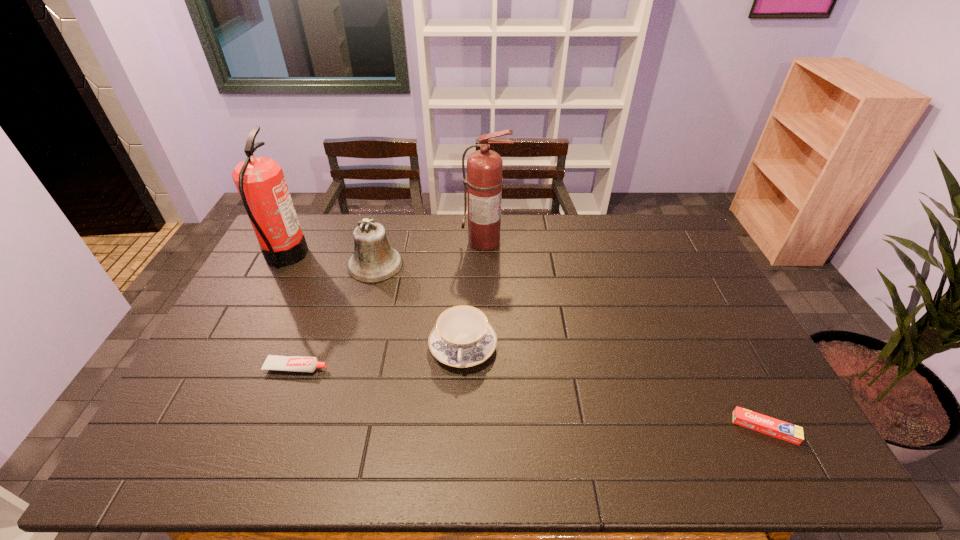
Where is `free space between the fourth tallest object and the nearest object`? free space between the fourth tallest object and the nearest object is located at coordinates pos(613,388).

At what (x,y) coordinates should I click in order to perform the action: click on free space between the leftmost object and the nearest object. Please return your answer as a coordinate pair (x, y). Image resolution: width=960 pixels, height=540 pixels. Looking at the image, I should click on (525, 342).

Locate an element on the screen. unoccupied area between the rightmost object and the second shortest object is located at coordinates (531, 397).

Point out which object is positioned as the third nearest to the third tallest object. Please provide its 2D coordinates. Your answer should be formatted as a tuple, i.e. [(x, y)], where the tuple contains the x and y coordinates of a point satisfying the conditions above.

[(462, 337)]

You are a GUI agent. You are given a task and a screenshot of the screen. Output one action in this format:
    pyautogui.click(x=<x>, y=<y>)
    Task: Click on the object that can be found as the fourth closest to the third shortest object
    
    Given the screenshot: What is the action you would take?
    pyautogui.click(x=261, y=184)

Locate an element on the screen. This screenshot has height=540, width=960. vacant space that satisfies the following two spatial constraints: 1. on the front side of the rightmost object; 2. on the right side of the leftmost object is located at coordinates (197, 428).

Identify the location of free space that satisfies the following two spatial constraints: 1. on the front side of the farther toothpaste; 2. on the right side of the rightmost object. This screenshot has height=540, width=960. (274, 428).

In order to click on vacant space that satisfies the following two spatial constraints: 1. on the front side of the farther toothpaste; 2. on the left side of the left fire extinguisher in this screenshot , I will do `click(228, 367)`.

At what (x,y) coordinates should I click in order to perform the action: click on vacant area in the image that satisfies the following two spatial constraints: 1. on the front side of the left fire extinguisher; 2. on the back side of the rightmost object. Please return your answer as a coordinate pair (x, y). Looking at the image, I should click on (197, 428).

The width and height of the screenshot is (960, 540). I want to click on free location that satisfies the following two spatial constraints: 1. on the front-facing side of the right fire extinguisher; 2. on the front side of the left fire extinguisher, so click(485, 256).